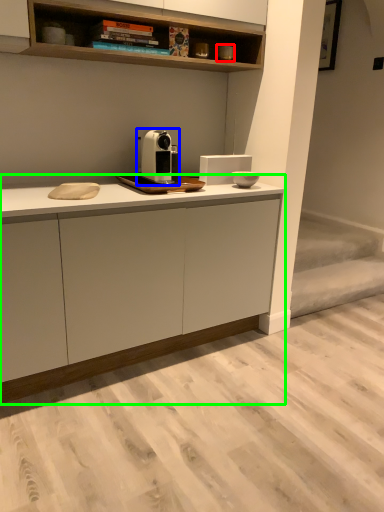
Question: Considering the real-world distances, which object is closest to appliance (highlighted by a red box)? home appliance (highlighted by a blue box) or cabinetry (highlighted by a green box).

Choices:
 (A) home appliance
 (B) cabinetry

Answer: (A)